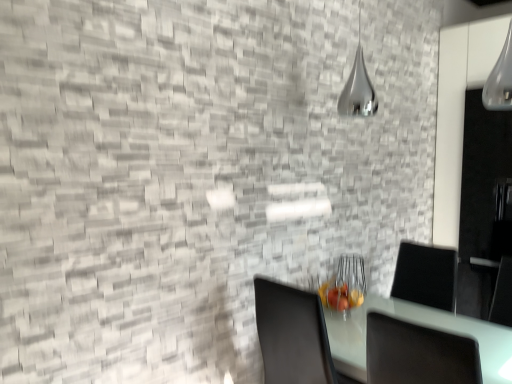
Question: Could you tell me if transparent glass door at right is turned towards white glossy table at lower right?

Choices:
 (A) no
 (B) yes

Answer: (A)

Question: Can you confirm if transparent glass door at right is positioned to the right of white glossy table at lower right?

Choices:
 (A) yes
 (B) no

Answer: (A)

Question: Can you confirm if transparent glass door at right is shorter than white glossy table at lower right?

Choices:
 (A) no
 (B) yes

Answer: (A)

Question: Does transparent glass door at right have a greater height compared to white glossy table at lower right?

Choices:
 (A) no
 (B) yes

Answer: (B)

Question: Is white glossy table at lower right completely or partially inside transparent glass door at right?

Choices:
 (A) no
 (B) yes

Answer: (A)

Question: In terms of width, does white glossy table at lower right look wider or thinner when compared to silver metallic lamp at upper center?

Choices:
 (A) thin
 (B) wide

Answer: (B)

Question: Is point (446, 319) positioned closer to the camera than point (362, 114)?

Choices:
 (A) farther
 (B) closer

Answer: (B)

Question: Is white glossy table at lower right inside the boundaries of silver metallic lamp at upper center, or outside?

Choices:
 (A) inside
 (B) outside

Answer: (B)

Question: From the image's perspective, is white glossy table at lower right located above or below silver metallic lamp at upper center?

Choices:
 (A) below
 (B) above

Answer: (A)

Question: Considering the positions of point (461, 286) and point (342, 104), is point (461, 286) closer or farther from the camera than point (342, 104)?

Choices:
 (A) closer
 (B) farther

Answer: (B)

Question: From a real-world perspective, is transparent glass door at right above or below silver metallic lamp at upper center?

Choices:
 (A) below
 (B) above

Answer: (A)

Question: From the image's perspective, is transparent glass door at right above or below silver metallic lamp at upper center?

Choices:
 (A) above
 (B) below

Answer: (B)

Question: Is transparent glass door at right taller or shorter than silver metallic lamp at upper center?

Choices:
 (A) short
 (B) tall

Answer: (B)

Question: Do you think transparent glass door at right is within white glossy table at lower right, or outside of it?

Choices:
 (A) outside
 (B) inside

Answer: (A)

Question: From their relative heights in the image, would you say transparent glass door at right is taller or shorter than white glossy table at lower right?

Choices:
 (A) tall
 (B) short

Answer: (A)